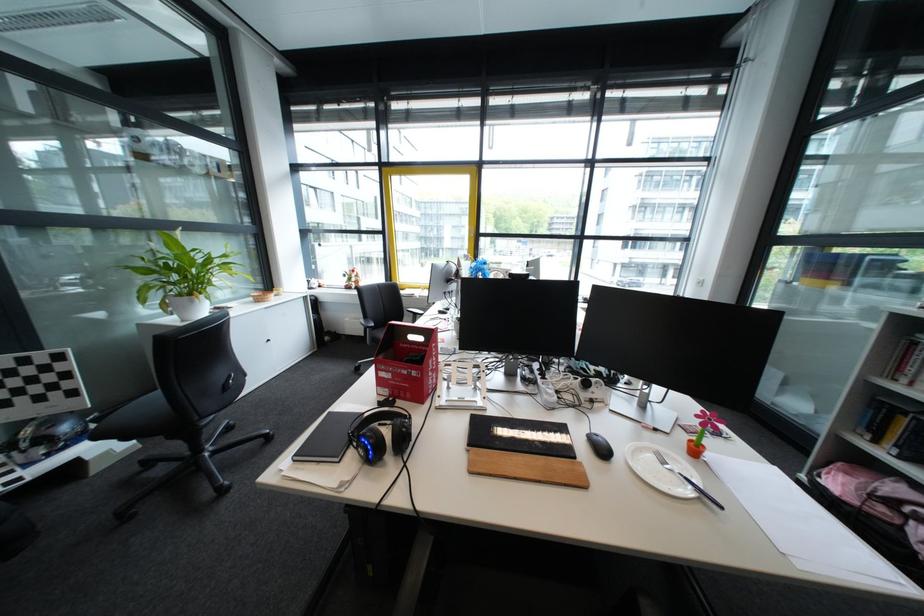
What do you see at coordinates (147, 411) in the screenshot? The image size is (924, 616). I see `a black chair sitting surface` at bounding box center [147, 411].